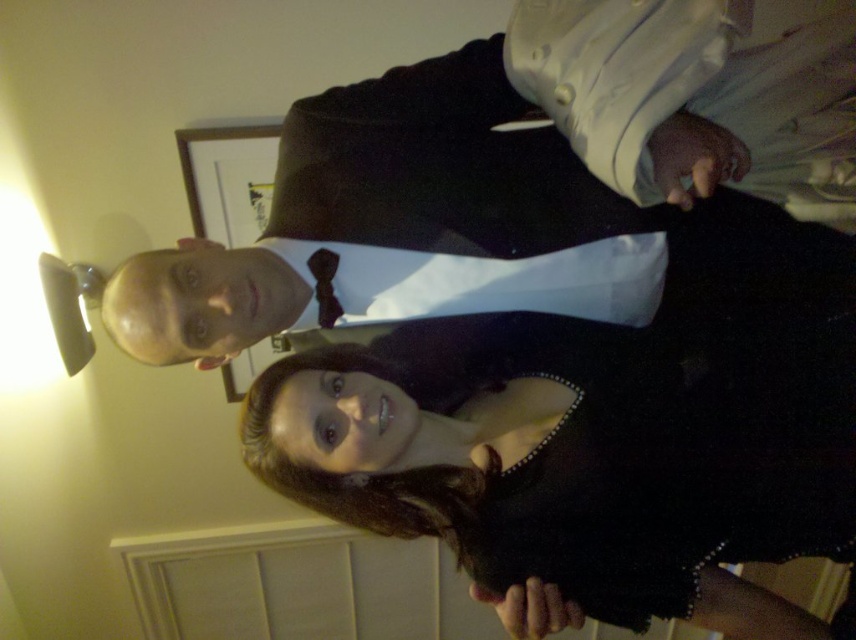
Is matte black suit at upper center below black satin dress at center?

Incorrect, matte black suit at upper center is not positioned below black satin dress at center.

Can you confirm if matte black suit at upper center is thinner than black satin dress at center?

In fact, matte black suit at upper center might be wider than black satin dress at center.

Is point (526, 10) less distant than point (646, 499)?

No, (526, 10) is behind (646, 499).

You are a GUI agent. You are given a task and a screenshot of the screen. Output one action in this format:
    pyautogui.click(x=<x>, y=<y>)
    Task: Click on the matte black suit at upper center
    
    Given the screenshot: What is the action you would take?
    pyautogui.click(x=528, y=173)

Does matte black suit at upper center appear over dark brown textured bow tie at center?

Correct, matte black suit at upper center is located above dark brown textured bow tie at center.

Who is more forward, (672,8) or (324,268)?

Point (672,8) is in front.

Where is `matte black suit at upper center`? matte black suit at upper center is located at coordinates (528, 173).

Is black satin dress at center positioned at the back of dark brown textured bow tie at center?

No, black satin dress at center is in front of dark brown textured bow tie at center.

I want to click on black satin dress at center, so click(586, 454).

Between point (383, 442) and point (314, 291), which one is positioned behind?

The point (314, 291) is behind.

Find the location of a particular element. black satin dress at center is located at coordinates (586, 454).